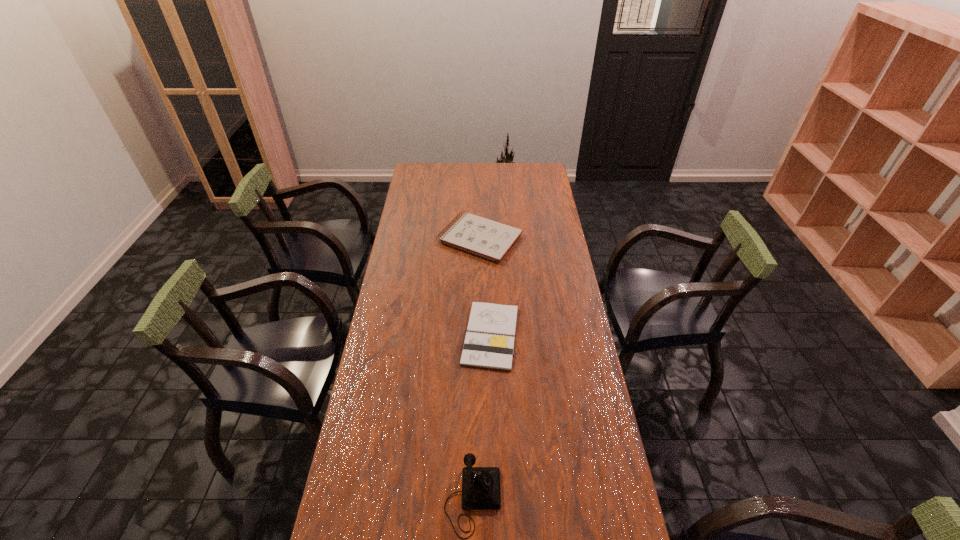
The width and height of the screenshot is (960, 540). In order to click on free space at the left edge of the desktop in this screenshot , I will do `click(349, 508)`.

The width and height of the screenshot is (960, 540). Find the location of `vacant space at the right edge of the desktop`. vacant space at the right edge of the desktop is located at coordinates (562, 279).

Find the location of a particular element. The height and width of the screenshot is (540, 960). vacant space that is in between the farther notepad and the nearer notepad is located at coordinates (486, 287).

Locate an element on the screen. This screenshot has width=960, height=540. free spot between the farthest object and the tallest object is located at coordinates (476, 368).

You are a GUI agent. You are given a task and a screenshot of the screen. Output one action in this format:
    pyautogui.click(x=<x>, y=<y>)
    Task: Click on the free space between the nearest object and the shortest object
    
    Given the screenshot: What is the action you would take?
    pyautogui.click(x=482, y=417)

Locate an element on the screen. vacant region between the nearest object and the farther notepad is located at coordinates coord(476,368).

Find the location of a particular element. Image resolution: width=960 pixels, height=540 pixels. vacant point located between the second shortest object and the tallest object is located at coordinates (476, 368).

Where is `free space that is in between the shorter notepad and the farther notepad`? The height and width of the screenshot is (540, 960). free space that is in between the shorter notepad and the farther notepad is located at coordinates (486, 287).

I want to click on free spot between the farther notepad and the tallest object, so click(x=476, y=368).

Find the location of `free space between the telephone and the second nearest object`. free space between the telephone and the second nearest object is located at coordinates (482, 417).